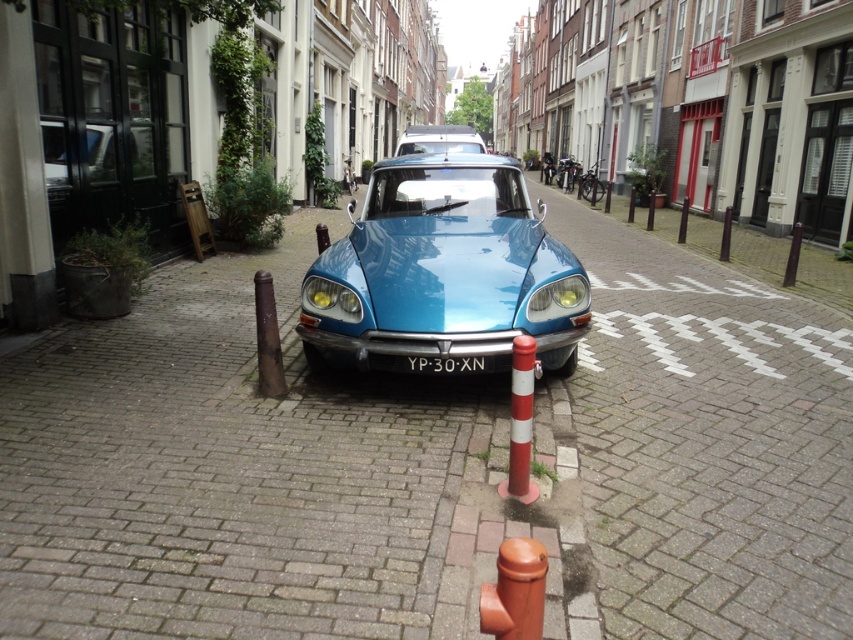
Which is behind, point (314, 276) or point (447, 364)?

The point (314, 276) is behind.

Is matte blue car at center to the right of black plastic license plate at center from the viewer's perspective?

→ No, matte blue car at center is not to the right of black plastic license plate at center.

Does point (508, 301) come closer to viewer compared to point (477, 365)?

That is False.

Locate an element on the screen. The height and width of the screenshot is (640, 853). matte blue car at center is located at coordinates (444, 272).

Is brown matte hydrant at lower center behind black plastic license plate at center?

That is False.

Does brown matte hydrant at lower center appear over black plastic license plate at center?

No, brown matte hydrant at lower center is not above black plastic license plate at center.

The height and width of the screenshot is (640, 853). Describe the element at coordinates (515, 592) in the screenshot. I see `brown matte hydrant at lower center` at that location.

Locate an element on the screen. This screenshot has height=640, width=853. brown matte hydrant at lower center is located at coordinates (515, 592).

Which is above, smooth brick pavement at center or brown matte hydrant at lower center?

Positioned higher is smooth brick pavement at center.

This screenshot has height=640, width=853. Describe the element at coordinates (430, 467) in the screenshot. I see `smooth brick pavement at center` at that location.

Which is in front, point (339, 488) or point (486, 604)?

Point (486, 604) is in front.

Locate an element on the screen. This screenshot has height=640, width=853. smooth brick pavement at center is located at coordinates (430, 467).